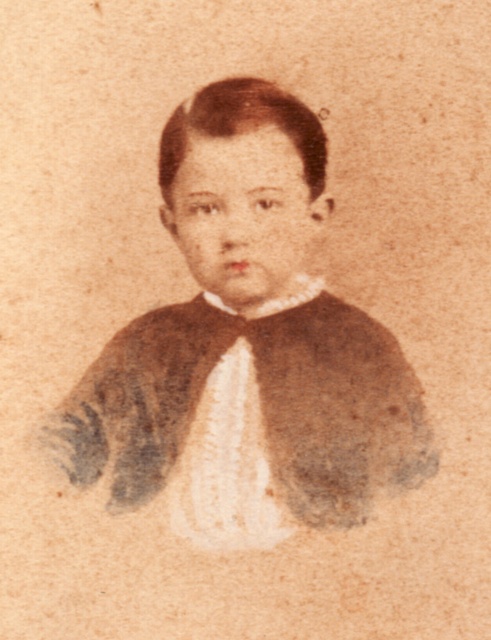
You are a photographer standing 1 meter away from a vintage portrait. The image shows a young boy wearing a brown textured sweater at center. If you want to take a closer look at the sweater, can you move forward without exceeding the recommended viewing distance of 1.5 meters for such delicate artworks?

The brown textured sweater at center is 1.26 meters away from the viewer. Since you are currently 1 meter away, moving forward would bring you closer than the recommended 1.5 meters. Therefore, you can safely move forward as the sweater is within the recommended distance limit.